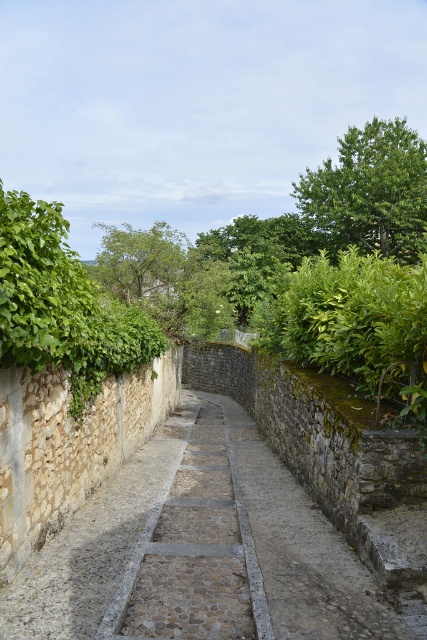
Based on the photo, can you confirm if stone paved path at center is taller than green leafy tree at upper right?

Incorrect, stone paved path at center's height is not larger of green leafy tree at upper right's.

Between stone paved path at center and green leafy tree at upper right, which one appears on the right side from the viewer's perspective?

Positioned to the right is green leafy tree at upper right.

At what (x,y) coordinates should I click in order to perform the action: click on stone paved path at center. Please return your answer as a coordinate pair (x, y). Looking at the image, I should click on (202, 550).

The height and width of the screenshot is (640, 427). I want to click on stone paved path at center, so click(x=202, y=550).

Between green leafy tree at upper right and green leafy tree at center, which one appears on the right side from the viewer's perspective?

From the viewer's perspective, green leafy tree at upper right appears more on the right side.

Which is below, green leafy tree at upper right or green leafy tree at center?

green leafy tree at center is below.

Who is more distant from viewer, [353,177] or [166,253]?

The point [353,177] is more distant.

Image resolution: width=427 pixels, height=640 pixels. In order to click on green leafy tree at upper right in this screenshot , I will do `click(371, 192)`.

Which is behind, point (145, 512) or point (111, 268)?

Positioned behind is point (111, 268).

The image size is (427, 640). What do you see at coordinates (202, 550) in the screenshot?
I see `stone paved path at center` at bounding box center [202, 550].

Where is `stone paved path at center`? This screenshot has width=427, height=640. stone paved path at center is located at coordinates (202, 550).